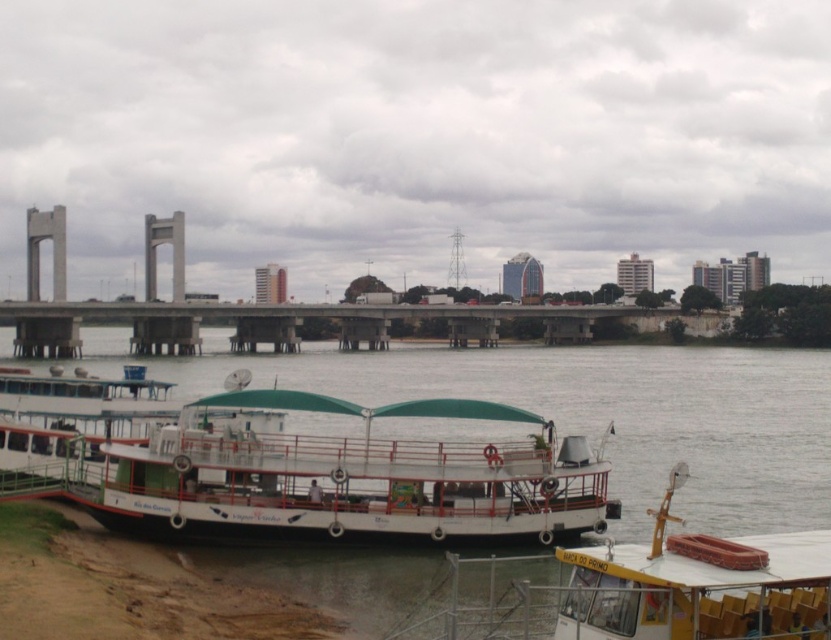
Question: In this image, where is white matte river at center located relative to yellow plastic chairs at lower right?

Choices:
 (A) below
 (B) above

Answer: (A)

Question: Which of these objects is positioned farthest from the yellow plastic chairs at lower right?

Choices:
 (A) white matte river at center
 (B) concrete dock at center

Answer: (B)

Question: Which object appears farthest from the camera in this image?

Choices:
 (A) white matte river at center
 (B) yellow plastic chairs at lower right
 (C) white matte boat at lower left
 (D) concrete dock at center

Answer: (D)

Question: Is white matte boat at lower left bigger than concrete dock at center?

Choices:
 (A) yes
 (B) no

Answer: (B)

Question: Which of the following is the closest to the observer?

Choices:
 (A) (635, 474)
 (B) (158, 456)
 (C) (635, 554)

Answer: (C)

Question: From the image, what is the correct spatial relationship of yellow plastic chairs at lower right in relation to concrete dock at center?

Choices:
 (A) below
 (B) above

Answer: (A)